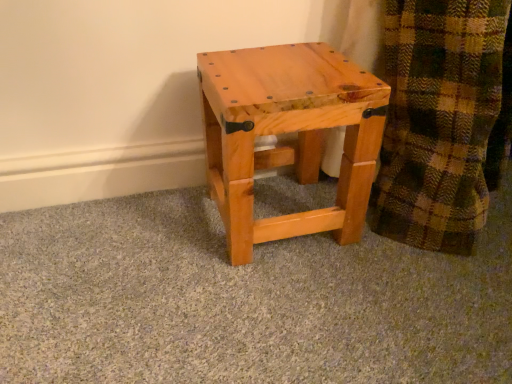
This screenshot has width=512, height=384. What are the coordinates of `free point above natural wood stool at center (from a real-world perspective)` in the screenshot? It's located at (291, 66).